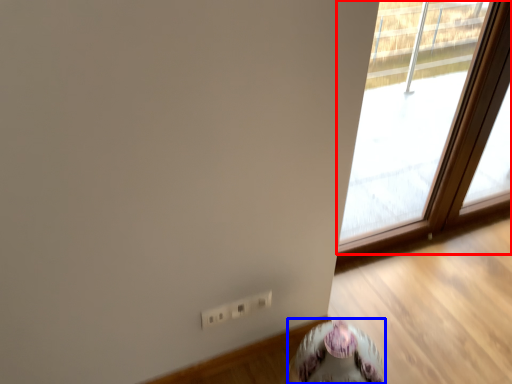
Question: Which of the following is the closest to the observer, window (highlighted by a red box) or round table (highlighted by a blue box)?

Choices:
 (A) window
 (B) round table

Answer: (B)